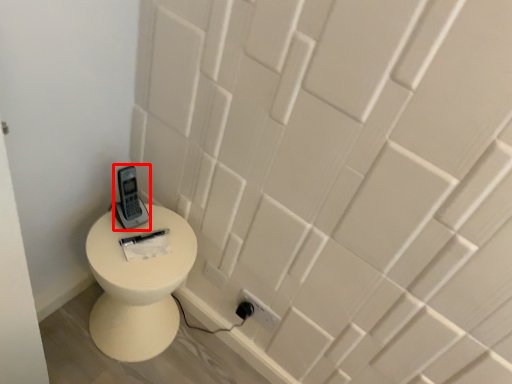
Question: From the image's perspective, where is control (annotated by the red box) located in relation to toilet in the image?

Choices:
 (A) above
 (B) below

Answer: (A)